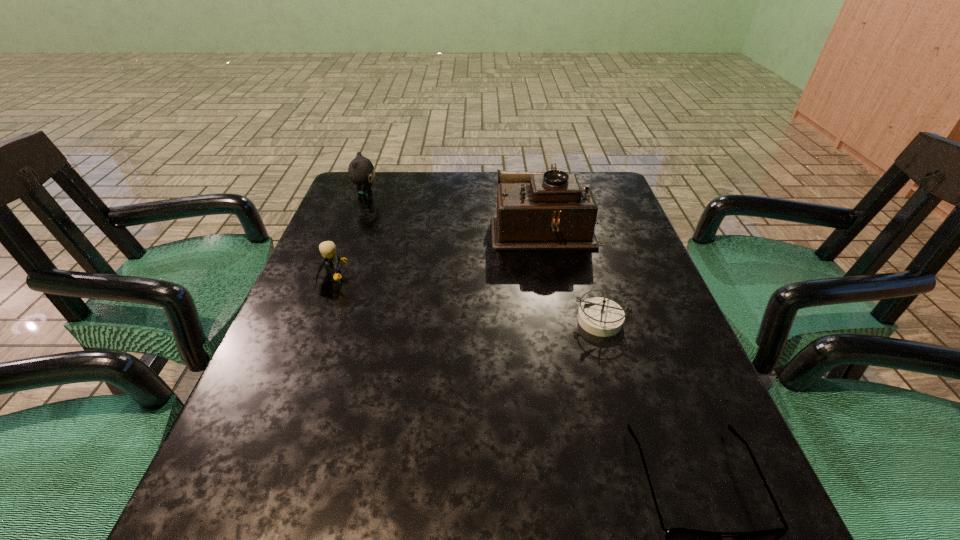
This screenshot has height=540, width=960. Identify the location of free point located on the left of the compass. (501, 319).

Where is `phonograph_record at the far edge`? The height and width of the screenshot is (540, 960). phonograph_record at the far edge is located at coordinates (535, 211).

Where is `kitten at the far edge`? This screenshot has height=540, width=960. kitten at the far edge is located at coordinates (361, 171).

This screenshot has height=540, width=960. I want to click on kitten positioned at the left edge, so click(x=361, y=171).

The width and height of the screenshot is (960, 540). I want to click on Lego at the left edge, so click(x=330, y=259).

Identify the location of phonograph_record located at the right edge. This screenshot has width=960, height=540. (535, 211).

What are the coordinates of `compass that is at the right edge` in the screenshot? It's located at (599, 316).

Where is `object situated at the far left corner`? object situated at the far left corner is located at coordinates (361, 171).

At what (x,y) coordinates should I click in order to perform the action: click on object located at the far right corner. Please return your answer as a coordinate pair (x, y). The height and width of the screenshot is (540, 960). Looking at the image, I should click on (535, 211).

In the image, there is a desktop. Where is `vacant space at the far edge`? vacant space at the far edge is located at coordinates (467, 188).